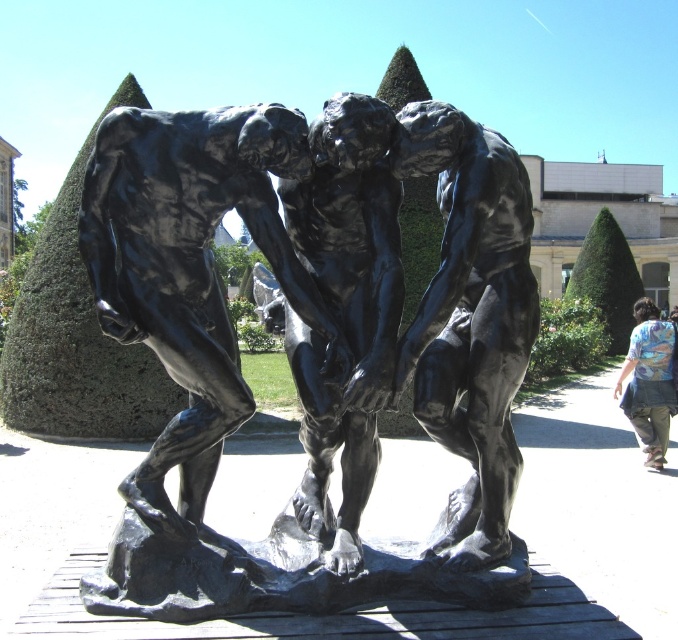
Is black polished bronze sculpture at center above black polished statue at center?

Incorrect, black polished bronze sculpture at center is not positioned above black polished statue at center.

Based on the photo, is black polished bronze sculpture at center wider than black polished statue at center?

Yes, black polished bronze sculpture at center is wider than black polished statue at center.

Identify the location of black polished bronze sculpture at center. (311, 401).

Image resolution: width=678 pixels, height=640 pixels. Identify the location of black polished bronze sculpture at center. (311, 401).

Is black polished stone sculpture at center shorter than black polished statue at center?

Indeed, black polished stone sculpture at center has a lesser height compared to black polished statue at center.

Where is `black polished stone sculpture at center`? black polished stone sculpture at center is located at coordinates (191, 269).

Where is `black polished stone sculpture at center`? black polished stone sculpture at center is located at coordinates (191, 269).

Between black polished stone sculpture at center and floral shirt at lower right, which one appears on the right side from the viewer's perspective?

floral shirt at lower right

Is black polished stone sculpture at center thinner than floral shirt at lower right?

Incorrect, black polished stone sculpture at center's width is not less than floral shirt at lower right's.

Where is `black polished stone sculpture at center`? The width and height of the screenshot is (678, 640). black polished stone sculpture at center is located at coordinates (191, 269).